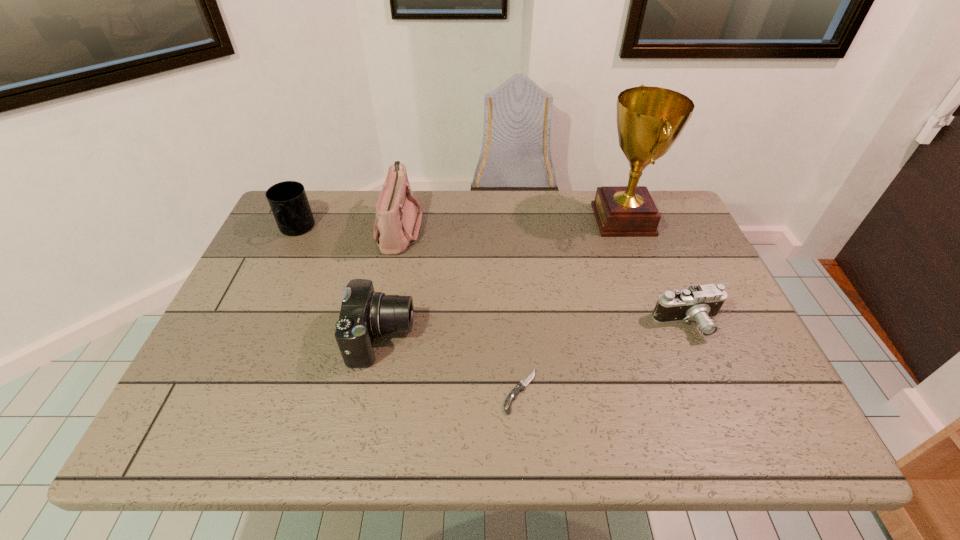
Where is `vacant space that satisfies the following two spatial constraints: 1. on the lens of the left camera; 2. on the right side of the pocketknife`? vacant space that satisfies the following two spatial constraints: 1. on the lens of the left camera; 2. on the right side of the pocketknife is located at coordinates (372, 391).

This screenshot has width=960, height=540. What are the coordinates of `blank space that satisfies the following two spatial constraints: 1. on the front pocket of the fifth shortest object; 2. on the back side of the pocketknife` in the screenshot? It's located at (367, 391).

Find the location of a particular element. vacant area in the image that satisfies the following two spatial constraints: 1. on the front pocket of the fifth shortest object; 2. on the back side of the pocketknife is located at coordinates (367, 391).

Find the location of a particular element. The height and width of the screenshot is (540, 960). free point that satisfies the following two spatial constraints: 1. on the side of the leftmost object with the handle; 2. on the left side of the third object from right to left is located at coordinates (221, 391).

This screenshot has width=960, height=540. What are the coordinates of `vacant position in the image that satisfies the following two spatial constraints: 1. on the front pocket of the shoulder bag; 2. on the side of the mug with the handle` in the screenshot? It's located at (399, 230).

This screenshot has width=960, height=540. I want to click on vacant space that satisfies the following two spatial constraints: 1. on the front pocket of the second tallest object; 2. on the back side of the pocketknife, so click(x=367, y=391).